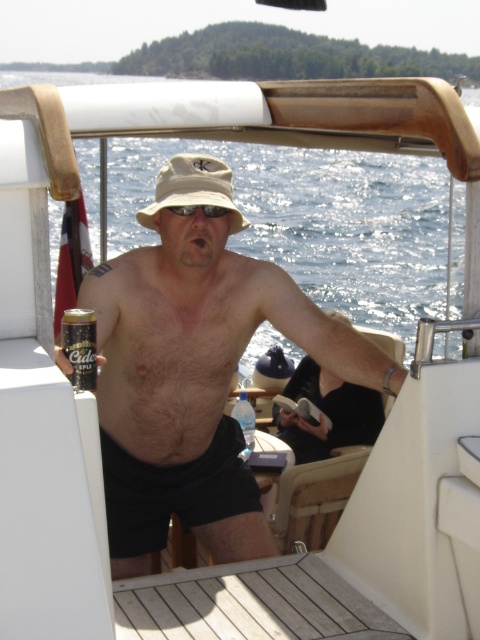
You are a fashion designer observing a man on a boat wearing a matte beige bucket hat at center and black cotton shorts at center. Which item is positioned higher on his body?

The matte beige bucket hat at center is located above the black cotton shorts at center, so it is positioned higher on his body.